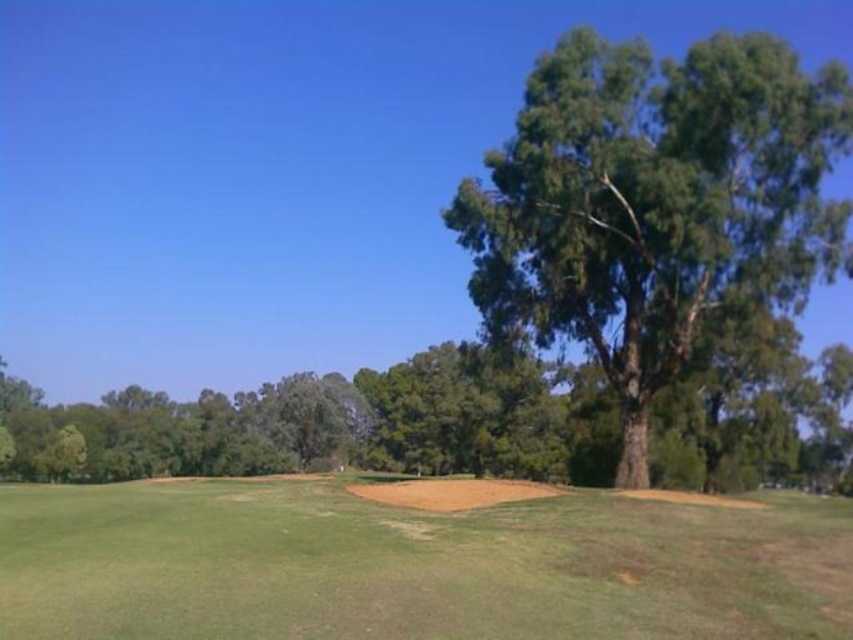
Question: Among these points, which one is farthest from the camera?

Choices:
 (A) (618, 509)
 (B) (729, 156)

Answer: (B)

Question: Can you confirm if green grassy field at center is bigger than green leafy tree at right?

Choices:
 (A) yes
 (B) no

Answer: (B)

Question: Is green grassy field at center thinner than green leafy tree at right?

Choices:
 (A) yes
 (B) no

Answer: (B)

Question: Is green grassy field at center above green leafy tree at right?

Choices:
 (A) no
 (B) yes

Answer: (A)